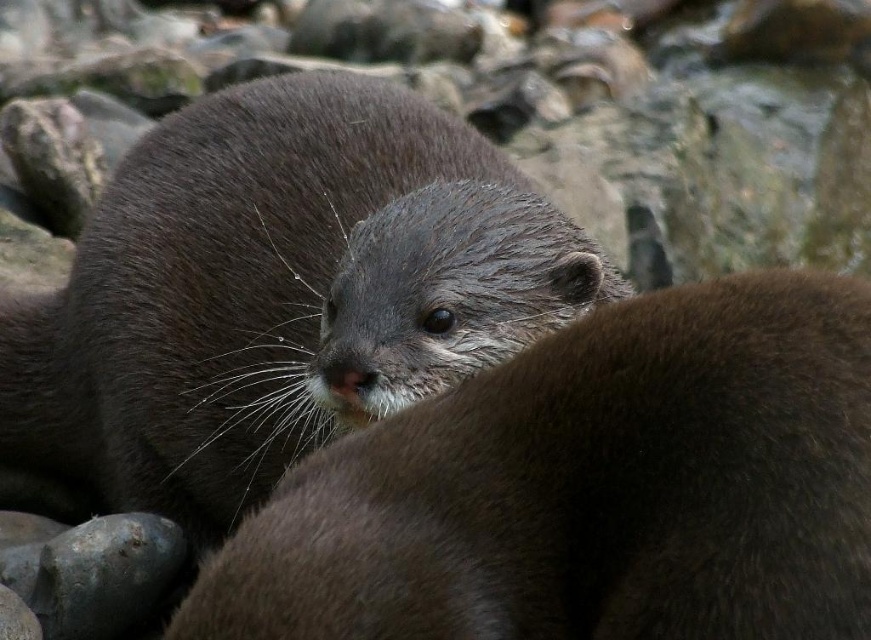
Question: Is soft brown fur otter at center positioned behind dark brown fur otter at center?

Choices:
 (A) yes
 (B) no

Answer: (B)

Question: Considering the relative positions of soft brown fur otter at center and dark brown fur otter at center in the image provided, where is soft brown fur otter at center located with respect to dark brown fur otter at center?

Choices:
 (A) left
 (B) right

Answer: (B)

Question: Is soft brown fur otter at center to the left of dark brown fur otter at center from the viewer's perspective?

Choices:
 (A) no
 (B) yes

Answer: (A)

Question: Among these objects, which one is farthest from the camera?

Choices:
 (A) soft brown fur otter at center
 (B) dark brown fur otter at center

Answer: (B)

Question: Which point is closer to the camera?

Choices:
 (A) (312, 177)
 (B) (721, 512)

Answer: (B)

Question: Which point is farther from the camera taking this photo?

Choices:
 (A) (510, 237)
 (B) (463, 440)

Answer: (A)